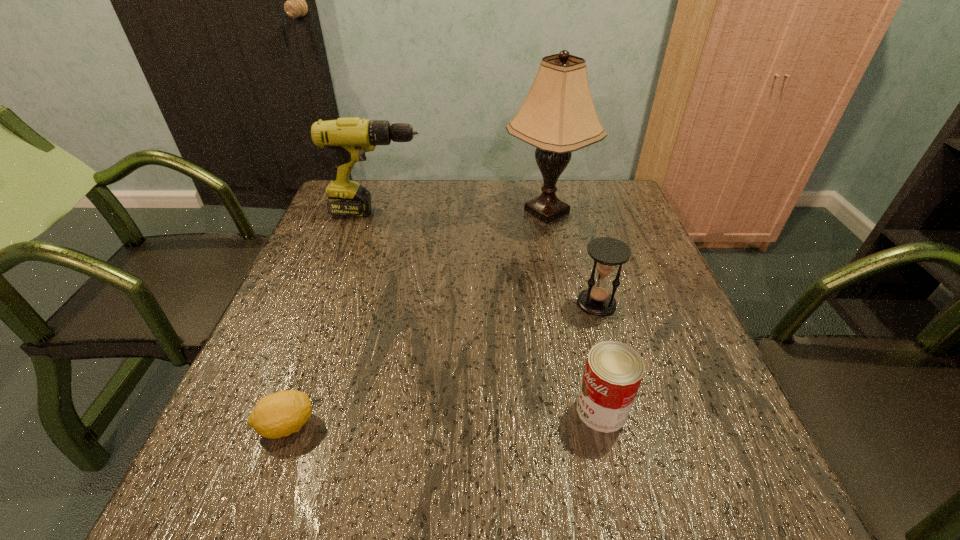
Locate an element on the screen. blank region between the lamp and the drill is located at coordinates (463, 212).

Where is `free space between the can and the lemon`? free space between the can and the lemon is located at coordinates (444, 417).

The image size is (960, 540). Find the location of `free area in between the fourth shortest object and the third farthest object`. free area in between the fourth shortest object and the third farthest object is located at coordinates (488, 258).

Select which object is the third closest to the lamp. Please provide its 2D coordinates. Your answer should be formatted as a tuple, i.e. [(x, y)], where the tuple contains the x and y coordinates of a point satisfying the conditions above.

[(613, 372)]

Where is `the third closest object relative to the fourth shortest object`? The image size is (960, 540). the third closest object relative to the fourth shortest object is located at coordinates (280, 414).

Identify the location of free point that satisfies the following two spatial constraints: 1. on the handle side of the third farthest object; 2. on the right side of the second tallest object. (349, 303).

Locate an element on the screen. The width and height of the screenshot is (960, 540). vacant position in the image that satisfies the following two spatial constraints: 1. on the handle side of the drill; 2. on the back side of the hourglass is located at coordinates (349, 303).

Identify the location of vacant area that satisfies the following two spatial constraints: 1. on the front side of the lamp; 2. on the right side of the hourglass. (566, 303).